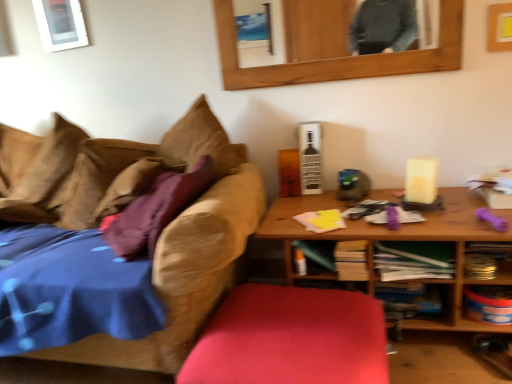
Question: Are smooth red cushion at center and wooden table at right making contact?

Choices:
 (A) yes
 (B) no

Answer: (B)

Question: From a real-world perspective, is smooth red cushion at center over wooden table at right?

Choices:
 (A) no
 (B) yes

Answer: (A)

Question: Considering the relative sizes of smooth red cushion at center and wooden table at right in the image provided, is smooth red cushion at center taller than wooden table at right?

Choices:
 (A) no
 (B) yes

Answer: (A)

Question: From the image's perspective, is smooth red cushion at center over wooden table at right?

Choices:
 (A) yes
 (B) no

Answer: (B)

Question: Can you confirm if smooth red cushion at center is positioned to the right of wooden table at right?

Choices:
 (A) no
 (B) yes

Answer: (A)

Question: Relative to white glossy picture frame at upper left, acting as the second picture frame starting from the bottom, is wooden book at center, the 3th book viewed from the left, in front or behind?

Choices:
 (A) behind
 (B) front

Answer: (B)

Question: From their relative heights in the image, would you say wooden book at center, the 3th book viewed from the left, is taller or shorter than white glossy picture frame at upper left, marked as the 1th picture frame in a left-to-right arrangement?

Choices:
 (A) short
 (B) tall

Answer: (A)

Question: Is wooden book at center, the 3th book viewed from the left, inside or outside of white glossy picture frame at upper left, marked as the 1th picture frame in a left-to-right arrangement?

Choices:
 (A) outside
 (B) inside

Answer: (A)

Question: From a real-world perspective, is wooden book at center, the 3th book viewed from the left, above or below white glossy picture frame at upper left, positioned as the 1th picture frame in top-to-bottom order?

Choices:
 (A) below
 (B) above

Answer: (A)

Question: Is point (307, 215) positioned closer to the camera than point (480, 299)?

Choices:
 (A) farther
 (B) closer

Answer: (A)

Question: In the image, is yellow paper at center, acting as the second book starting from the left, positioned in front of or behind metallic silver canister at lower right, the 2th shelf viewed from the top?

Choices:
 (A) front
 (B) behind

Answer: (B)

Question: From a real-world perspective, is yellow paper at center, positioned as the 3th book in right-to-left order, above or below metallic silver canister at lower right, the 1th shelf in the bottom-to-top sequence?

Choices:
 (A) below
 (B) above

Answer: (B)

Question: In terms of size, does yellow paper at center, acting as the second book starting from the left, appear bigger or smaller than metallic silver canister at lower right, the 1th shelf in the bottom-to-top sequence?

Choices:
 (A) big
 (B) small

Answer: (B)

Question: In terms of width, does wooden table at right look wider or thinner when compared to green matte book at center, the 1th book positioned from the left?

Choices:
 (A) wide
 (B) thin

Answer: (A)

Question: Is wooden table at right bigger or smaller than green matte book at center, which is the 4th book in right-to-left order?

Choices:
 (A) small
 (B) big

Answer: (B)